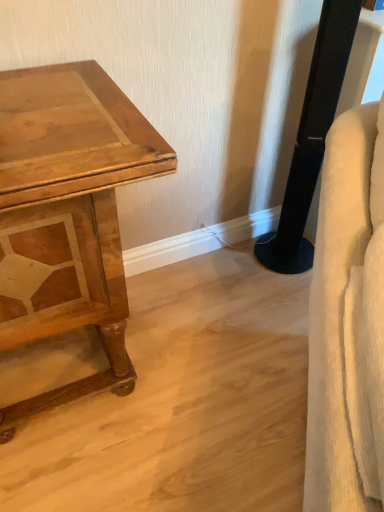
Question: Considering the relative sizes of black plastic speaker at right and wooden table at left in the image provided, is black plastic speaker at right wider than wooden table at left?

Choices:
 (A) no
 (B) yes

Answer: (A)

Question: Is black plastic speaker at right oriented away from wooden table at left?

Choices:
 (A) yes
 (B) no

Answer: (B)

Question: Is black plastic speaker at right oriented towards wooden table at left?

Choices:
 (A) no
 (B) yes

Answer: (A)

Question: Does black plastic speaker at right come behind wooden table at left?

Choices:
 (A) yes
 (B) no

Answer: (A)

Question: Is black plastic speaker at right at the left side of wooden table at left?

Choices:
 (A) no
 (B) yes

Answer: (A)

Question: From a real-world perspective, is white fabric swivel chair at right physically located above or below black plastic speaker at right?

Choices:
 (A) above
 (B) below

Answer: (A)

Question: Which is correct: white fabric swivel chair at right is inside black plastic speaker at right, or outside of it?

Choices:
 (A) outside
 (B) inside

Answer: (A)

Question: Would you say white fabric swivel chair at right is to the left or to the right of black plastic speaker at right in the picture?

Choices:
 (A) left
 (B) right

Answer: (A)

Question: From their relative heights in the image, would you say white fabric swivel chair at right is taller or shorter than black plastic speaker at right?

Choices:
 (A) tall
 (B) short

Answer: (B)

Question: Is black plastic speaker at right in front of or behind wooden table at left in the image?

Choices:
 (A) front
 (B) behind

Answer: (B)

Question: Is black plastic speaker at right to the left or to the right of wooden table at left in the image?

Choices:
 (A) right
 (B) left

Answer: (A)

Question: Is black plastic speaker at right bigger or smaller than wooden table at left?

Choices:
 (A) big
 (B) small

Answer: (B)

Question: Is black plastic speaker at right wider or thinner than wooden table at left?

Choices:
 (A) wide
 (B) thin

Answer: (B)

Question: From a real-world perspective, is black plastic speaker at right positioned above or below white fabric swivel chair at right?

Choices:
 (A) above
 (B) below

Answer: (B)

Question: From the image's perspective, is black plastic speaker at right above or below white fabric swivel chair at right?

Choices:
 (A) below
 (B) above

Answer: (B)